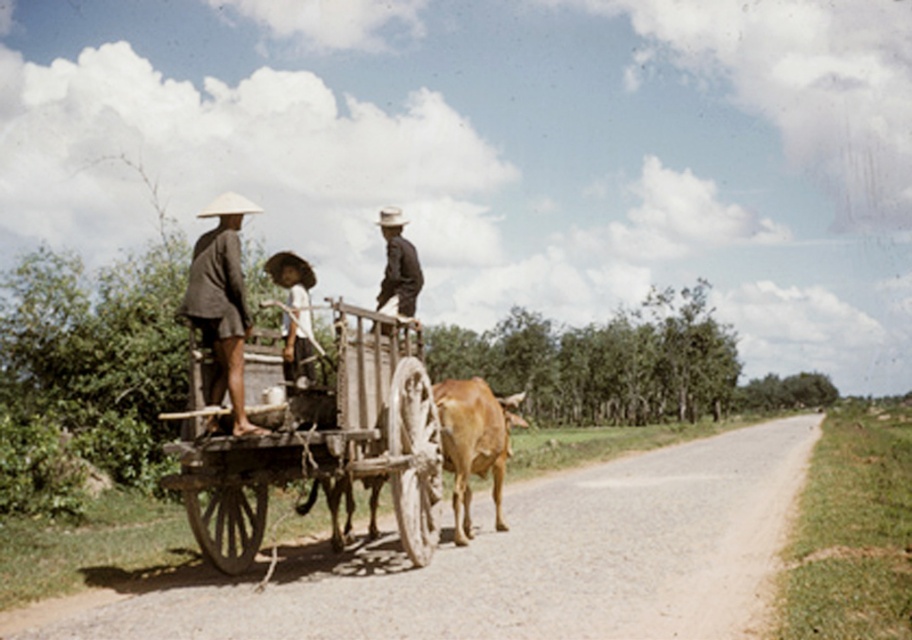
Question: Among these objects, which one is farthest from the camera?

Choices:
 (A) brown straw hat at upper center
 (B) brown glossy bull at center

Answer: (B)

Question: Does wooden wagon at center have a greater width compared to brown straw hat at upper center?

Choices:
 (A) yes
 (B) no

Answer: (B)

Question: Which point appears closest to the camera in this image?

Choices:
 (A) (392, 305)
 (B) (467, 467)
 (C) (284, 317)
 (D) (183, 307)

Answer: (D)

Question: Which of the following is the farthest from the observer?

Choices:
 (A) dark brown fabric hat at center
 (B) brown straw hat at upper center
 (C) brown glossy bull at center

Answer: (C)

Question: Is wooden wagon at center positioned behind brown glossy bull at center?

Choices:
 (A) yes
 (B) no

Answer: (B)

Question: Is brown glossy bull at center bigger than dark brown fabric hat at center?

Choices:
 (A) yes
 (B) no

Answer: (A)